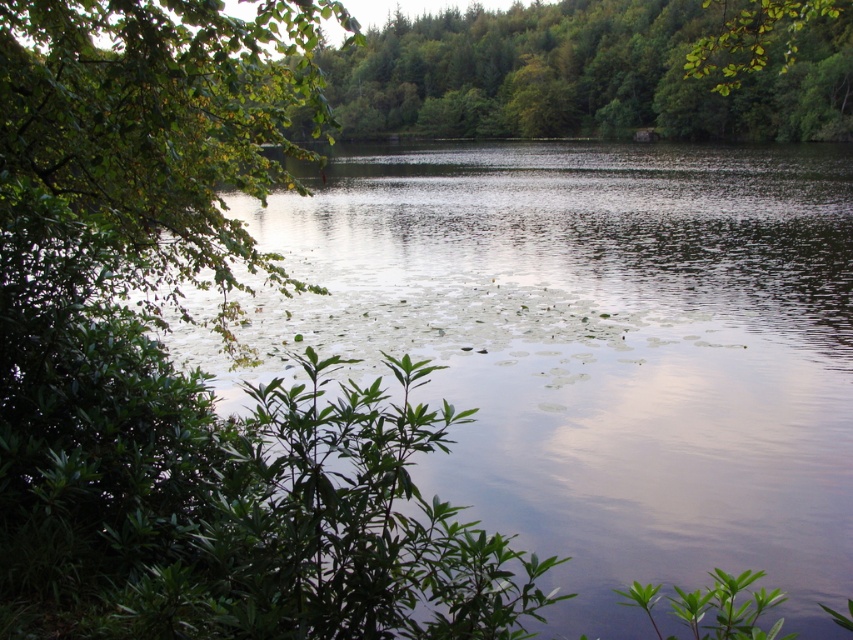
Question: Among these objects, which one is farthest from the camera?

Choices:
 (A) green leafy tree at center
 (B) green leafy river at left
 (C) green leafy tree at left

Answer: (A)

Question: Does green leafy tree at left appear over green leafy tree at center?

Choices:
 (A) yes
 (B) no

Answer: (B)

Question: Which point is farther to the camera?

Choices:
 (A) green leafy river at left
 (B) green leafy tree at left

Answer: (A)

Question: Can you confirm if green leafy river at left is positioned to the right of green leafy tree at center?

Choices:
 (A) yes
 (B) no

Answer: (B)

Question: Can you confirm if green leafy river at left is positioned to the right of green leafy tree at left?

Choices:
 (A) no
 (B) yes

Answer: (B)

Question: Which of the following is the closest to the observer?

Choices:
 (A) (285, 364)
 (B) (259, 33)
 (C) (721, 138)

Answer: (B)